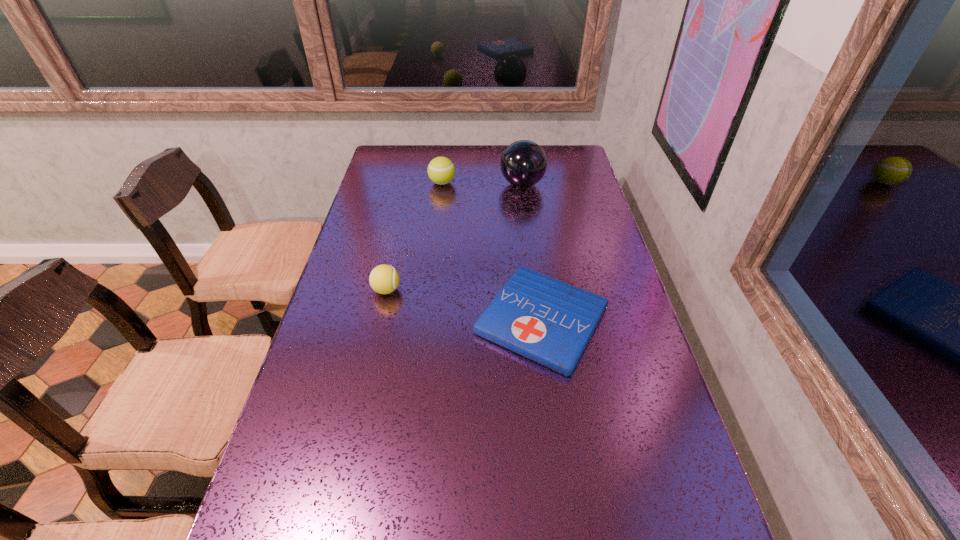
Identify the location of vacant area located 0.170m on the right of the leftmost object. (461, 290).

This screenshot has width=960, height=540. Find the location of `free space located on the front of the first-aid kit`. free space located on the front of the first-aid kit is located at coordinates (567, 508).

At what (x,y) coordinates should I click in order to perform the action: click on object at the far edge. Please return your answer as a coordinate pair (x, y). Looking at the image, I should click on (523, 163).

Locate an element on the screen. The image size is (960, 540). object at the left edge is located at coordinates (384, 279).

You are a GUI agent. You are given a task and a screenshot of the screen. Output one action in this format:
    pyautogui.click(x=<x>, y=<y>)
    Task: Click on the object at the right edge
    
    Given the screenshot: What is the action you would take?
    pyautogui.click(x=546, y=320)

The image size is (960, 540). What are the coordinates of `vacant space at the far edge of the desktop` in the screenshot? It's located at (492, 148).

The width and height of the screenshot is (960, 540). In order to click on vacant space at the left edge in this screenshot , I will do `click(366, 337)`.

This screenshot has width=960, height=540. Identify the location of vacant area at the right edge. (575, 242).

This screenshot has height=540, width=960. I want to click on free spot between the shortest object and the bowling ball, so click(532, 252).

Locate an element on the screen. This screenshot has height=540, width=960. free space between the leftmost object and the third shortest object is located at coordinates (415, 237).